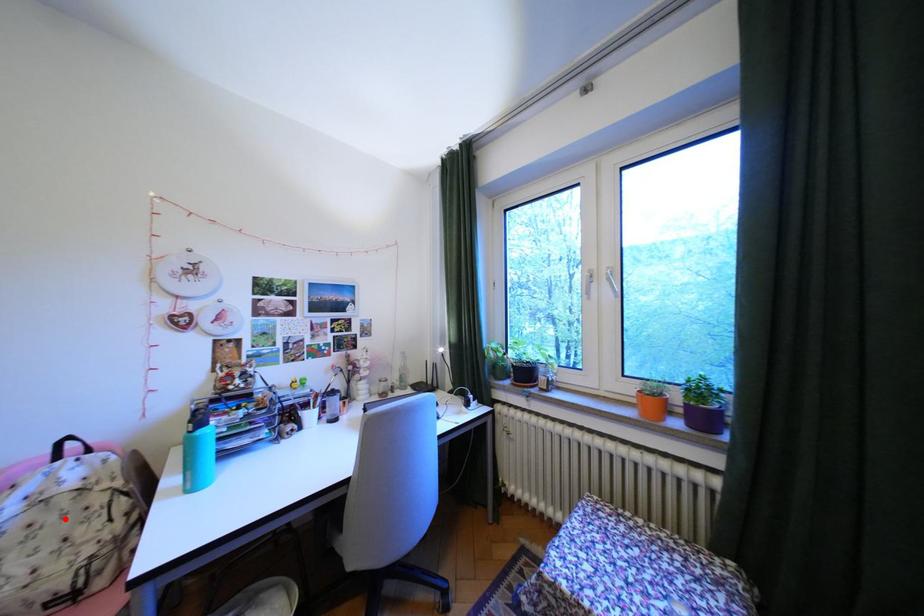
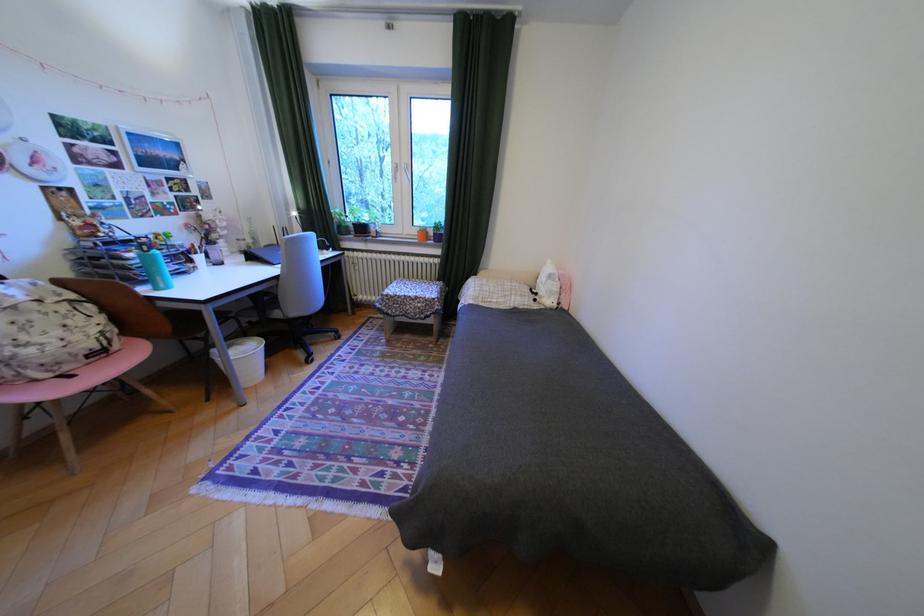
Question: I am providing you with two images of the same scene from different viewpoints. A red point is shown in image1. For the corresponding object point in image2, is it positioned nearer or farther from the camera?

Choices:
 (A) Nearer
 (B) Farther

Answer: (B)